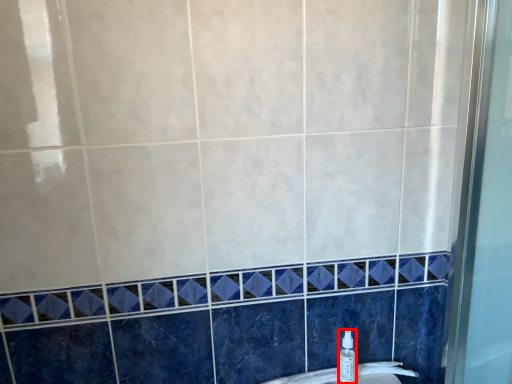
Question: From the image, what is the correct spatial relationship of toiletry (annotated by the red box) in relation to sink?

Choices:
 (A) right
 (B) left

Answer: (A)